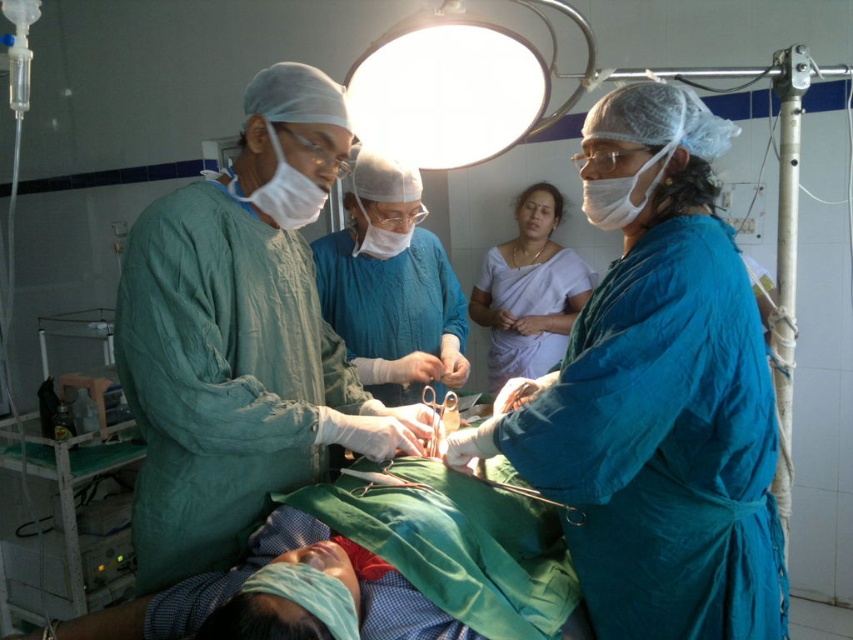
Question: Is blue scrubs at center wider than green scrubs at center?

Choices:
 (A) yes
 (B) no

Answer: (A)

Question: Can you confirm if blue scrubs at center is positioned to the right of green scrubs at center?

Choices:
 (A) yes
 (B) no

Answer: (A)

Question: Which point is farther to the camera?

Choices:
 (A) blue scrubs at center
 (B) white silk saree at center
 (C) green scrubs at center
 (D) surgical scissors at center

Answer: (B)

Question: Which point appears closest to the camera in this image?

Choices:
 (A) (281, 264)
 (B) (430, 394)
 (C) (554, 285)

Answer: (A)

Question: Is blue scrubs at center thinner than green scrubs at center?

Choices:
 (A) yes
 (B) no

Answer: (B)

Question: Which is farther from the blue scrubs at center?

Choices:
 (A) green scrubs at center
 (B) white silk saree at center
 (C) surgical scissors at center

Answer: (B)